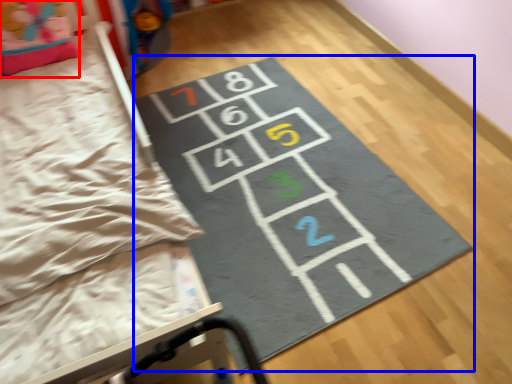
Question: Among these objects, which one is farthest to the camera, pillow (highlighted by a red box) or yoga mat (highlighted by a blue box)?

Choices:
 (A) pillow
 (B) yoga mat

Answer: (A)